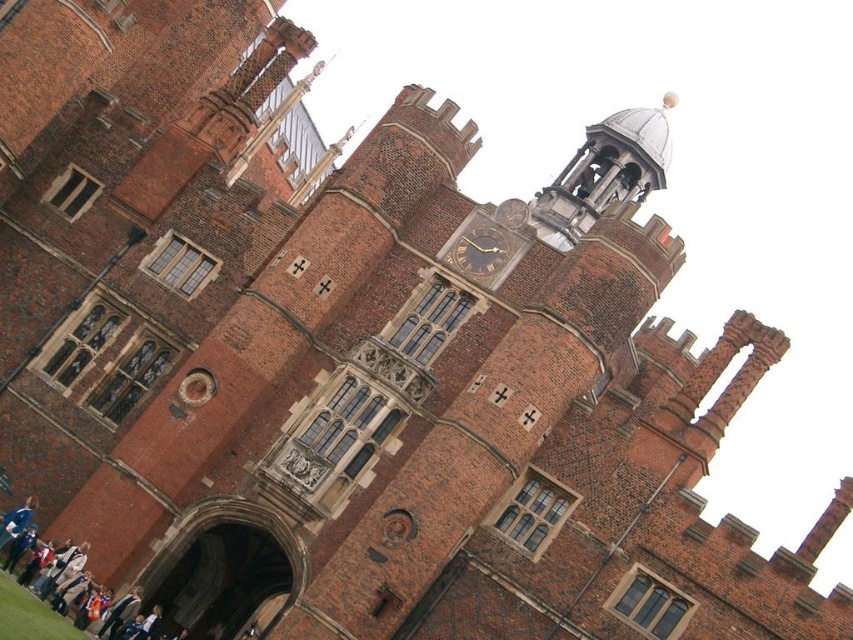
Question: Can you confirm if white cotton shirt at lower left is bigger than gold metallic clock at upper center?

Choices:
 (A) no
 (B) yes

Answer: (B)

Question: Which point is closer to the camera?

Choices:
 (A) white cotton shirt at lower left
 (B) gold metallic clock at upper center

Answer: (A)

Question: Is white cotton shirt at lower left behind gold metallic clock at upper center?

Choices:
 (A) no
 (B) yes

Answer: (A)

Question: Is white cotton shirt at lower left positioned before gold metallic clock at upper center?

Choices:
 (A) no
 (B) yes

Answer: (B)